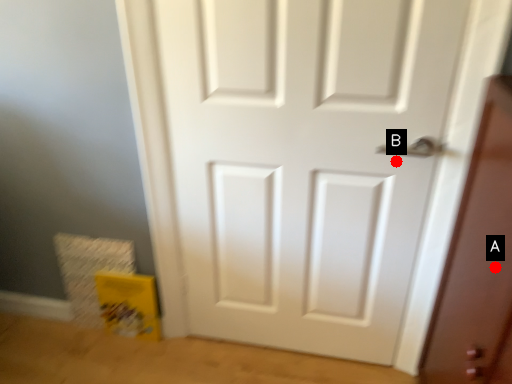
Question: Two points are circled on the image, labeled by A and B beside each circle. Which of the following is the farthest from the observer?

Choices:
 (A) A is further
 (B) B is further

Answer: (B)